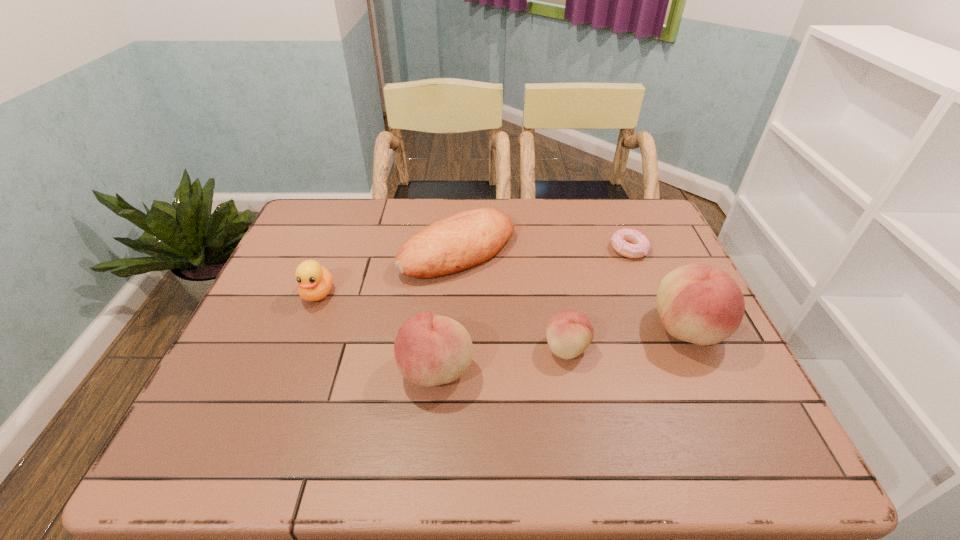
This screenshot has width=960, height=540. I want to click on free spot that satisfies the following two spatial constraints: 1. on the face of the duckling; 2. on the left side of the shortest peach, so click(x=297, y=348).

Find the location of a particular element. Image resolution: width=960 pixels, height=540 pixels. free location that satisfies the following two spatial constraints: 1. on the back side of the bread; 2. on the left side of the leftmost peach is located at coordinates (446, 251).

This screenshot has height=540, width=960. I want to click on vacant space that satisfies the following two spatial constraints: 1. on the face of the duckling; 2. on the right side of the second peach from right to left, so click(x=297, y=348).

Where is `vacant space that satisfies the following two spatial constraints: 1. on the face of the leftmost object; 2. on the right side of the rightmost peach`? The height and width of the screenshot is (540, 960). vacant space that satisfies the following two spatial constraints: 1. on the face of the leftmost object; 2. on the right side of the rightmost peach is located at coordinates (304, 328).

Identify the location of vacant area in the image that satisfies the following two spatial constraints: 1. on the back side of the bread; 2. on the right side of the fifth shortest object. (446, 251).

The image size is (960, 540). Identify the location of free location that satisfies the following two spatial constraints: 1. on the face of the duckling; 2. on the left side of the rightmost peach. (304, 328).